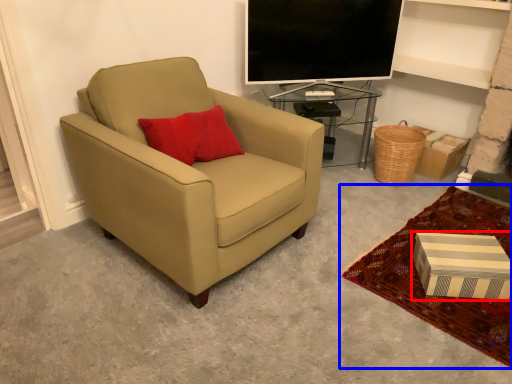
Question: Which object appears closest to the camera in this image, box (highlighted by a red box) or plain (highlighted by a blue box)?

Choices:
 (A) box
 (B) plain

Answer: (B)